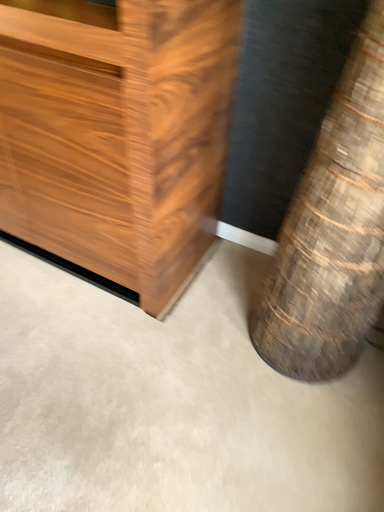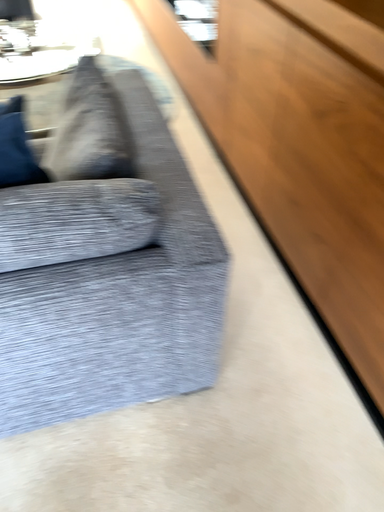
Question: How did the camera likely rotate when shooting the video?

Choices:
 (A) rotated left
 (B) rotated right

Answer: (A)